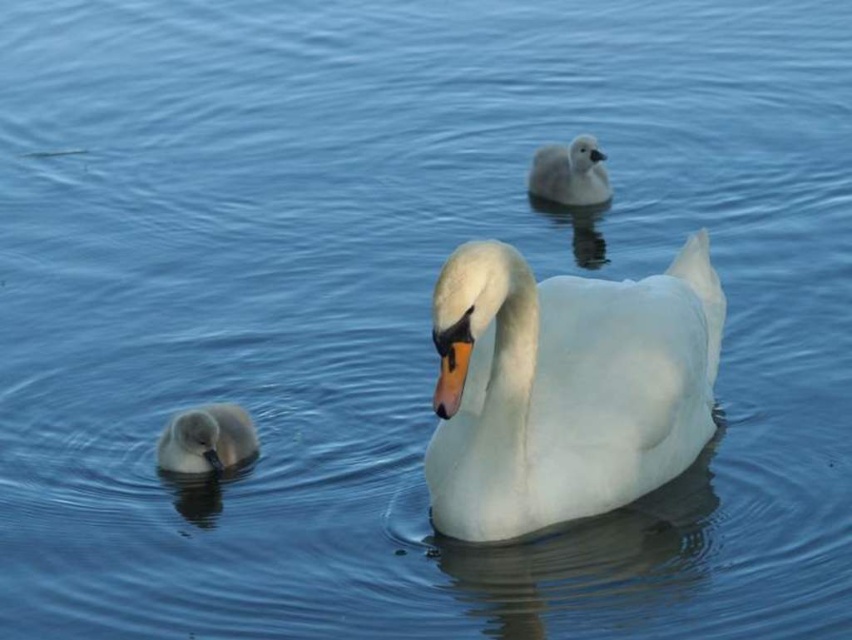
Question: Observing the image, what is the correct spatial positioning of soft gray duckling at lower left in reference to white fluffy duckling at upper center?

Choices:
 (A) below
 (B) above

Answer: (A)

Question: Among these points, which one is farthest from the camera?

Choices:
 (A) (239, 436)
 (B) (573, 205)

Answer: (B)

Question: Which object is the closest to the soft gray duckling at lower left?

Choices:
 (A) white glossy swan at center
 (B) white fluffy duckling at upper center

Answer: (A)

Question: In this image, where is soft gray duckling at lower left located relative to white fluffy duckling at upper center?

Choices:
 (A) above
 (B) below

Answer: (B)

Question: Which point appears farthest from the camera in this image?

Choices:
 (A) (707, 358)
 (B) (240, 426)

Answer: (B)

Question: Can you confirm if white glossy swan at center is positioned above white fluffy duckling at upper center?

Choices:
 (A) yes
 (B) no

Answer: (B)